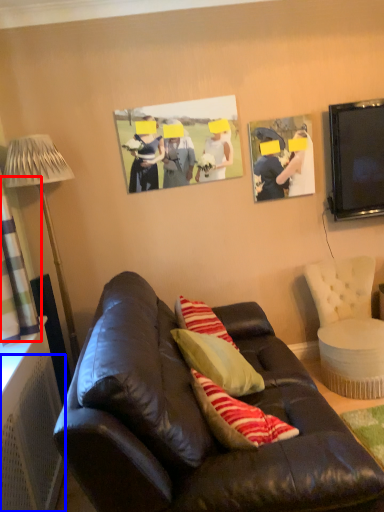
Question: Which object appears closest to the camera in this image, curtain (highlighted by a red box) or radiator (highlighted by a blue box)?

Choices:
 (A) curtain
 (B) radiator

Answer: (B)